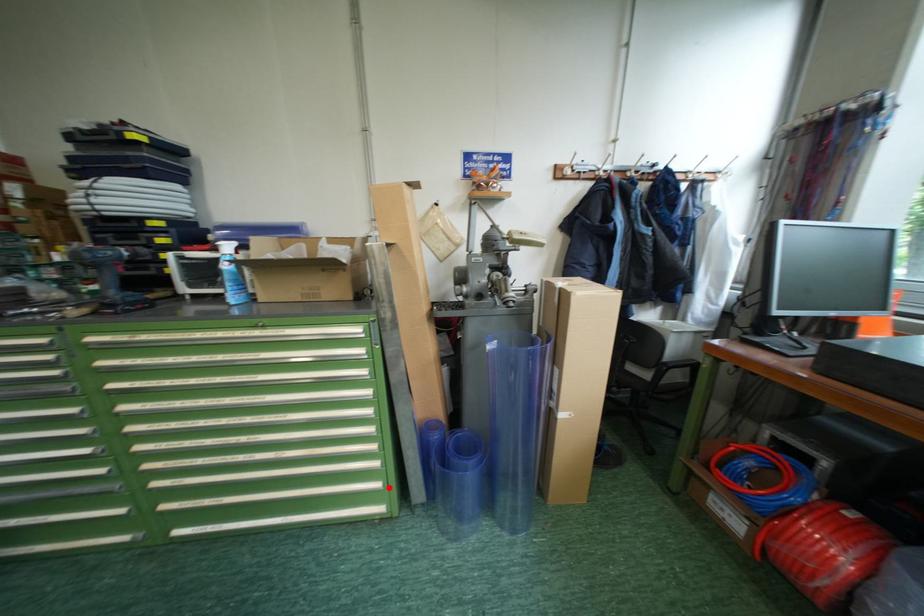
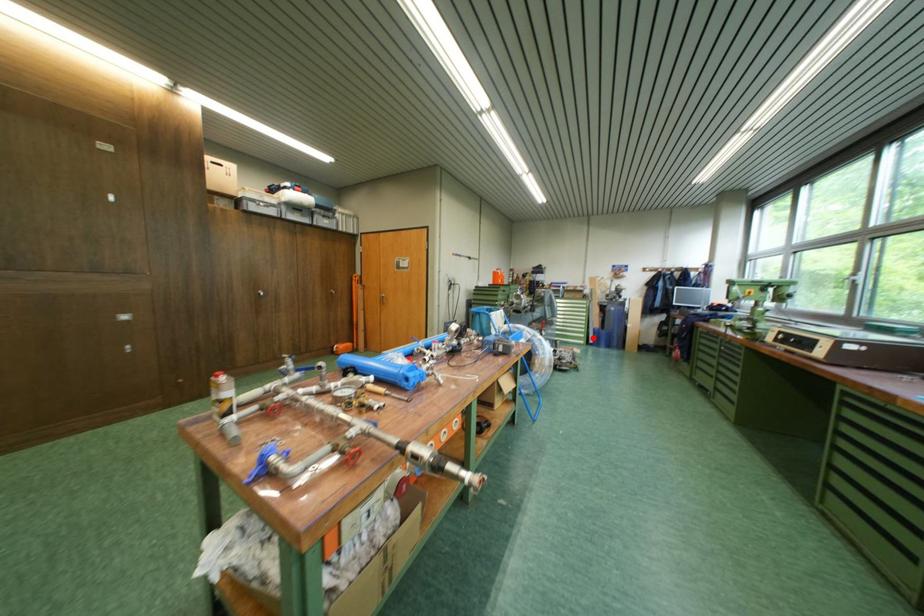
I am providing you with two images of the same scene from different viewpoints. A red point is marked on the first image and another point is marked on the second image. Are the points marked in image1 and image2 representing the same 3D position?

Yes